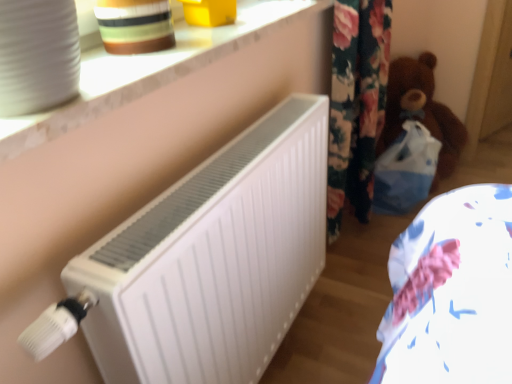
Locate an element on the screen. space that is in front of striped ceramic pot at upper left is located at coordinates (126, 71).